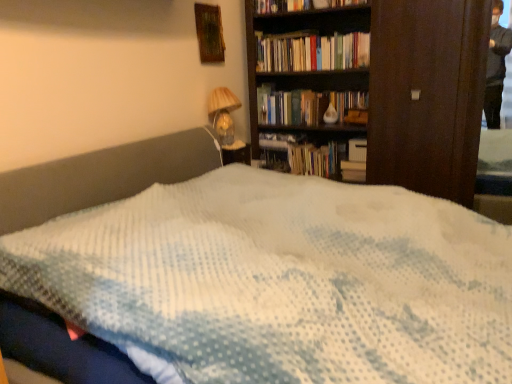
Question: Does hardcover books at upper center lie behind wooden frame at upper center?

Choices:
 (A) yes
 (B) no

Answer: (A)

Question: Is hardcover books at upper center shorter than wooden frame at upper center?

Choices:
 (A) no
 (B) yes

Answer: (B)

Question: Is wooden frame at upper center completely or partially inside hardcover books at upper center?

Choices:
 (A) yes
 (B) no

Answer: (B)

Question: Is hardcover books at upper center not inside wooden frame at upper center?

Choices:
 (A) no
 (B) yes

Answer: (B)

Question: From the image's perspective, does hardcover books at upper center appear lower than wooden frame at upper center?

Choices:
 (A) yes
 (B) no

Answer: (A)

Question: From a real-world perspective, is hardcover books at upper center located beneath wooden frame at upper center?

Choices:
 (A) yes
 (B) no

Answer: (A)

Question: Can you confirm if wooden frame at upper center is positioned to the left of matte glass table lamp at upper center?

Choices:
 (A) yes
 (B) no

Answer: (A)

Question: From a real-world perspective, is wooden frame at upper center under matte glass table lamp at upper center?

Choices:
 (A) no
 (B) yes

Answer: (A)

Question: From the image's perspective, is wooden frame at upper center above matte glass table lamp at upper center?

Choices:
 (A) yes
 (B) no

Answer: (A)

Question: Considering the relative positions of wooden frame at upper center and matte glass table lamp at upper center in the image provided, is wooden frame at upper center to the right of matte glass table lamp at upper center from the viewer's perspective?

Choices:
 (A) no
 (B) yes

Answer: (A)

Question: Is wooden frame at upper center closer to camera compared to matte glass table lamp at upper center?

Choices:
 (A) yes
 (B) no

Answer: (A)

Question: From a real-world perspective, is wooden frame at upper center on matte glass table lamp at upper center?

Choices:
 (A) yes
 (B) no

Answer: (A)

Question: Can you confirm if matte glass table lamp at upper center is wider than wooden frame at upper center?

Choices:
 (A) yes
 (B) no

Answer: (A)